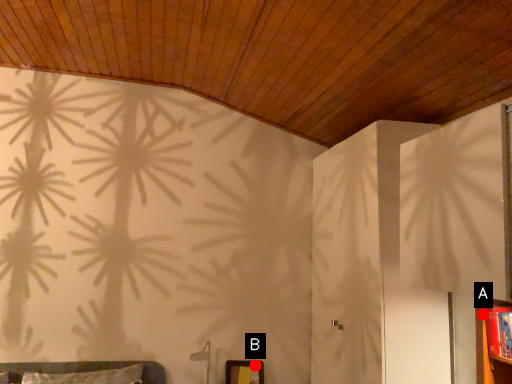
Question: Two points are circled on the image, labeled by A and B beside each circle. Which of the following is the farthest from the observer?

Choices:
 (A) A is further
 (B) B is further

Answer: (B)